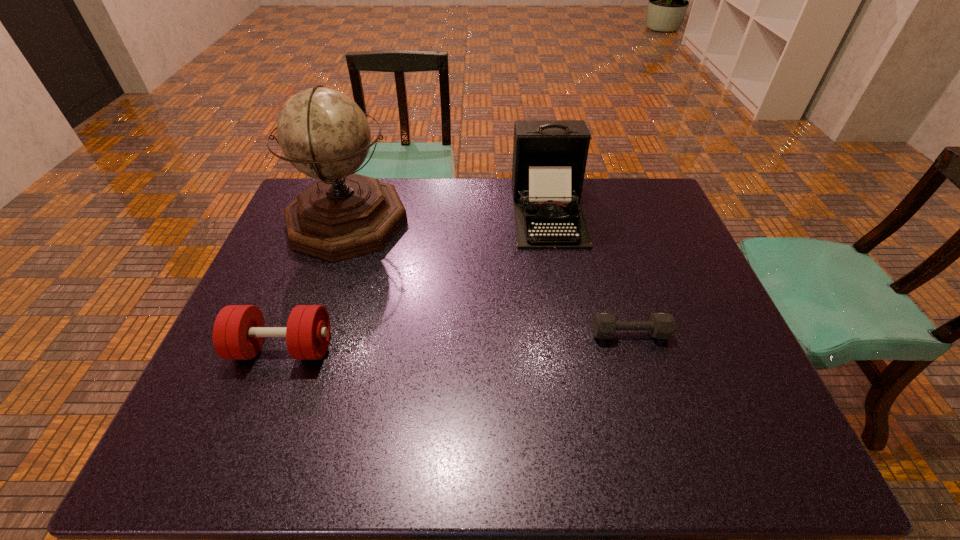
What are the coordinates of `globe that is at the far edge` in the screenshot? It's located at (323, 133).

Find the location of `typewriter that is at the far edge`. typewriter that is at the far edge is located at coordinates (549, 156).

In order to click on globe positioned at the left edge in this screenshot , I will do `click(323, 133)`.

Image resolution: width=960 pixels, height=540 pixels. What are the coordinates of `dumbbell at the left edge` in the screenshot? It's located at (238, 333).

I want to click on object positioned at the right edge, so click(660, 325).

At what (x,y) coordinates should I click in order to perform the action: click on object present at the far left corner. Please return your answer as a coordinate pair (x, y). This screenshot has width=960, height=540. Looking at the image, I should click on (323, 133).

Find the location of a particular element. This screenshot has width=960, height=540. free space at the far edge is located at coordinates (454, 195).

You are a GUI agent. You are given a task and a screenshot of the screen. Output one action in this format:
    pyautogui.click(x=<x>, y=<y>)
    Task: Click on the free space at the near edge of the desktop
    The height and width of the screenshot is (540, 960).
    Given the screenshot: What is the action you would take?
    pyautogui.click(x=539, y=461)

Identify the location of free space at the left edge of the desktop. (255, 286).

This screenshot has height=540, width=960. What are the coordinates of `vacant space at the right edge` in the screenshot? It's located at (656, 267).